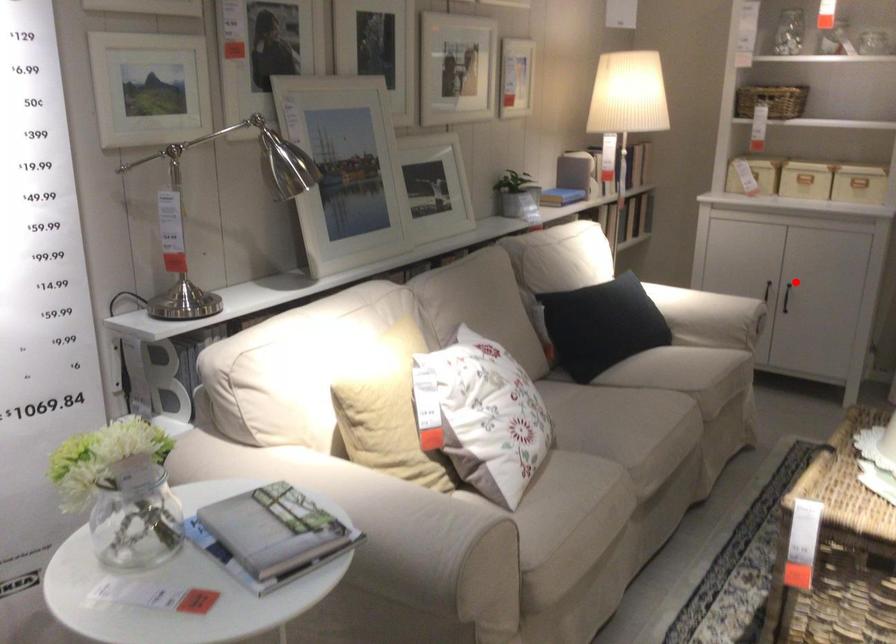
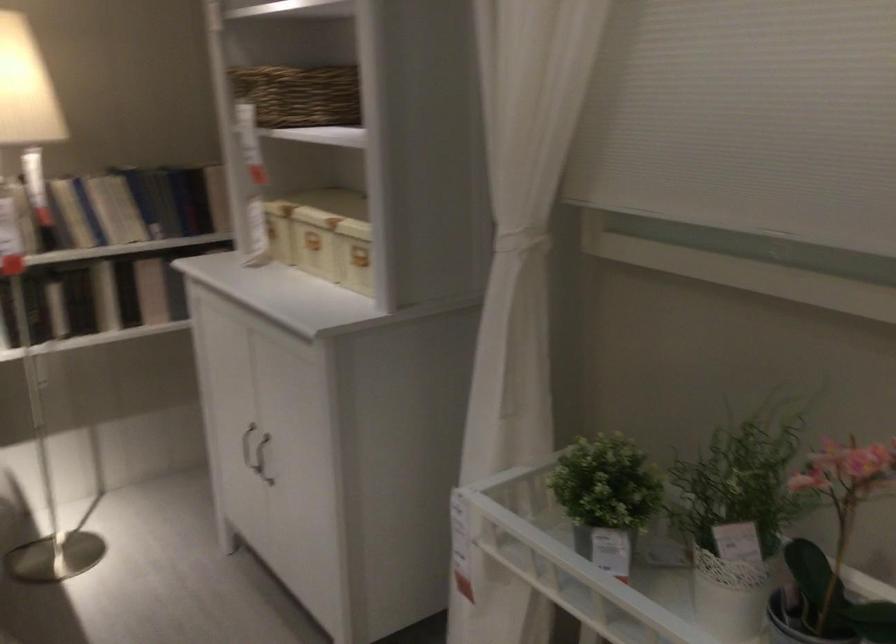
Where in the second image is the point corresponding to the highlighted location from the first image?

(262, 459)